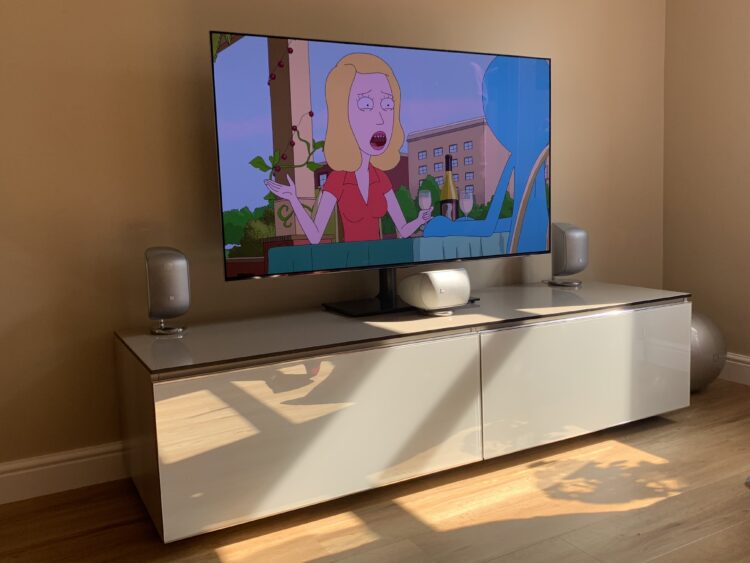
Where is `speakers`? The height and width of the screenshot is (563, 750). speakers is located at coordinates (172, 282), (576, 245).